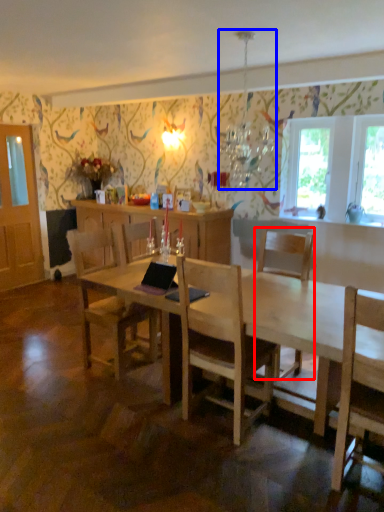
Question: Which point is closer to the camera, chair (highlighted by a red box) or lamp (highlighted by a blue box)?

Choices:
 (A) chair
 (B) lamp

Answer: (B)